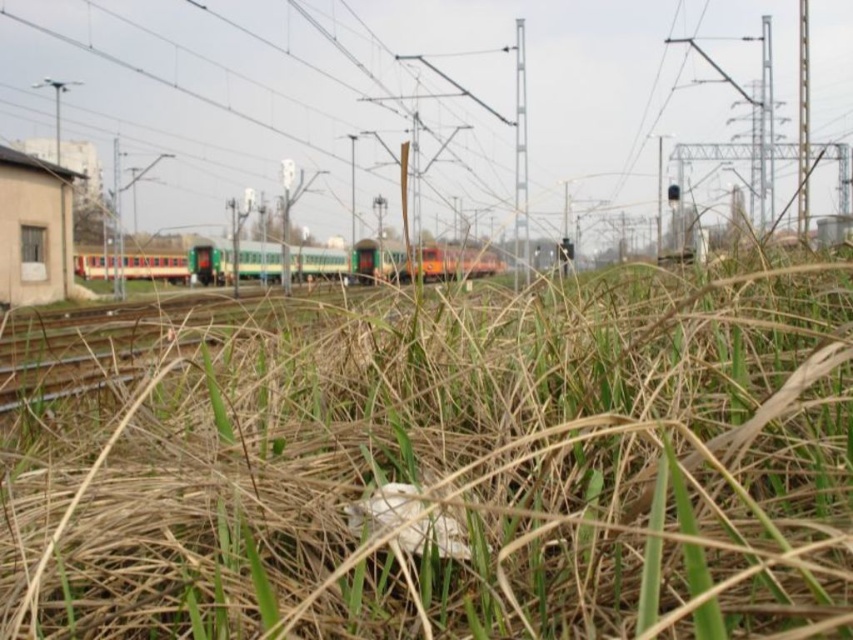
You are standing at the edge of the railway scene and see the dry grass at center and the green matte train at center. Which object is nearer to you?

The dry grass at center is closer to the viewer than the green matte train at center.

You are a maintenance worker checking the railway tracks. You notice the dry grass at center and the green matte train at center. Which object is taller?

The green matte train at center is taller than the dry grass at center.